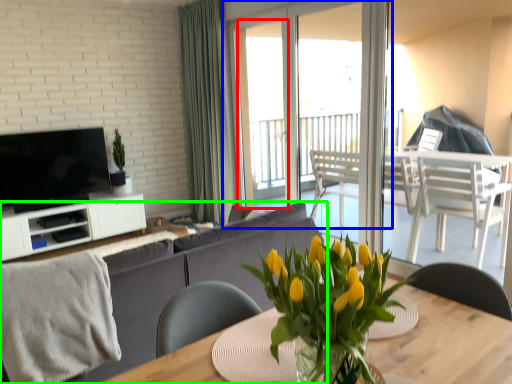
Question: Which object is the farthest from window screen (highlighted by a red box)? Choose among these: window (highlighted by a blue box) or studio couch (highlighted by a green box).

Choices:
 (A) window
 (B) studio couch

Answer: (B)